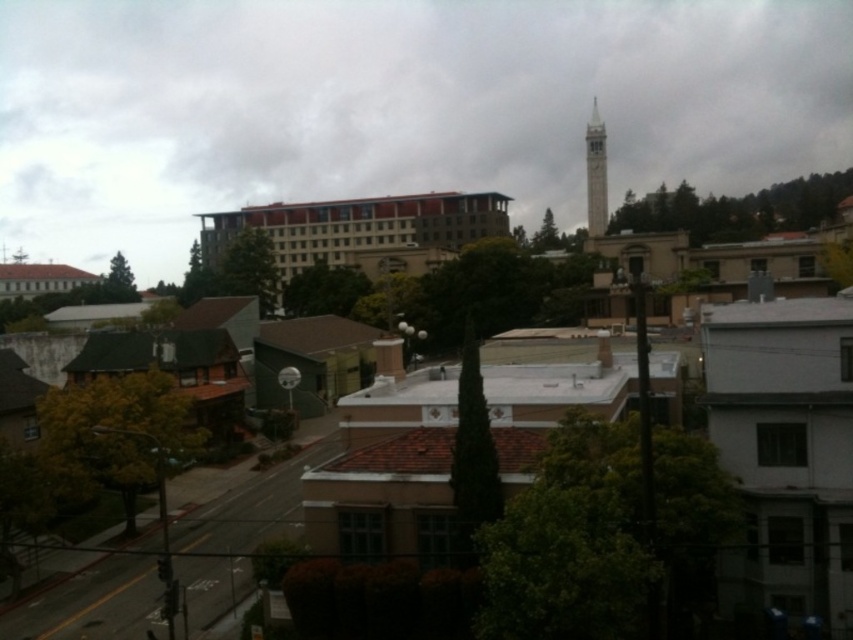
Question: Is white stone tower at center positioned at the back of smooth white bell tower at upper center?

Choices:
 (A) yes
 (B) no

Answer: (B)

Question: Which object is closer to the camera taking this photo?

Choices:
 (A) white stone tower at center
 (B) smooth white bell tower at upper center

Answer: (A)

Question: Which object is closer to the camera taking this photo?

Choices:
 (A) white stone tower at center
 (B) smooth white bell tower at upper center

Answer: (A)

Question: Is white stone tower at center to the right of smooth white bell tower at upper center from the viewer's perspective?

Choices:
 (A) no
 (B) yes

Answer: (A)

Question: Does white stone tower at center have a smaller size compared to smooth white bell tower at upper center?

Choices:
 (A) yes
 (B) no

Answer: (B)

Question: Among these objects, which one is nearest to the camera?

Choices:
 (A) smooth white bell tower at upper center
 (B) white stone tower at center

Answer: (B)